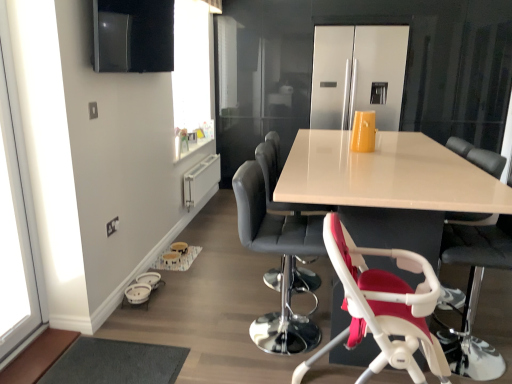
You are a GUI agent. You are given a task and a screenshot of the screen. Output one action in this format:
    pyautogui.click(x=<x>, y=<y>)
    Task: Click on the vacant area that lies to the right of white plastic baby carriage at lower left
    The image size is (512, 384).
    Given the screenshot: What is the action you would take?
    pyautogui.click(x=182, y=297)